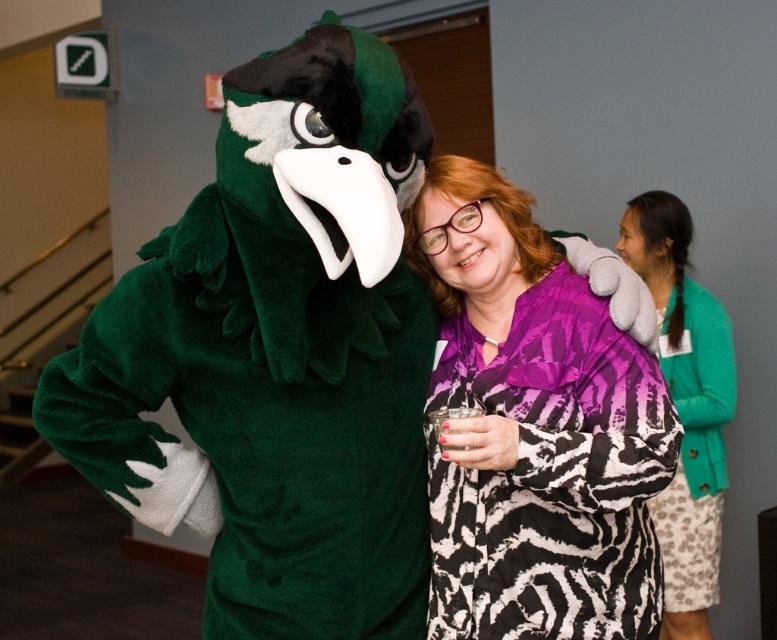
You are a photographer at an event and need to capture a photo of both the purple printed shirt at center and the green fuzzy sweater at right. Your camera has a minimum focus distance of 1.5 meters. Will you be able to take a photo of both subjects without moving closer?

The distance between the purple printed shirt at center and the green fuzzy sweater at right is 1.27 meters. Since the camera requires a minimum focus distance of 1.5 meters, you will need to move closer to ensure both subjects are in focus.

You are at a party and see two people wearing the purple printed shirt at center and the green fuzzy sweater at right. Which one is covering part of the other?

The purple printed shirt at center is positioned over the green fuzzy sweater at right, so the purple printed shirt at center is covering part of the green fuzzy sweater at right.

You are at a party and want to take a photo of both the purple printed shirt at center and the green fuzzy sweater at right. Since you can only focus on one person at a time, which one should you focus on to ensure the other is still somewhat in the frame?

You should focus on the purple printed shirt at center because it is in front of the green fuzzy sweater at right, so focusing on the front object will keep the background object somewhat in the frame.